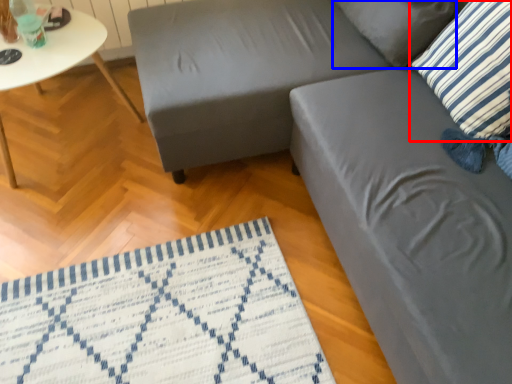
Question: Which of the following is the closest to the observer, pillow (highlighted by a red box) or pillow (highlighted by a blue box)?

Choices:
 (A) pillow
 (B) pillow

Answer: (A)